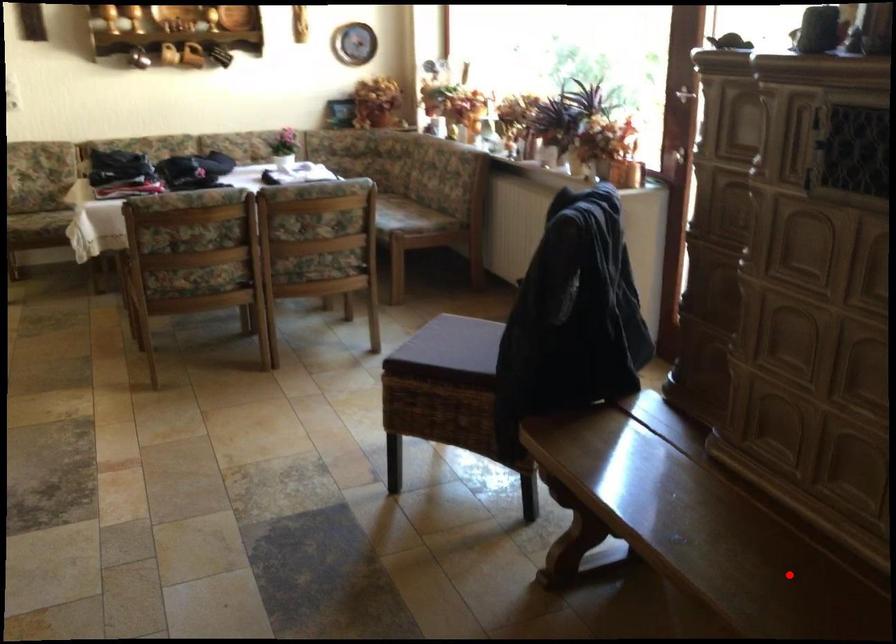
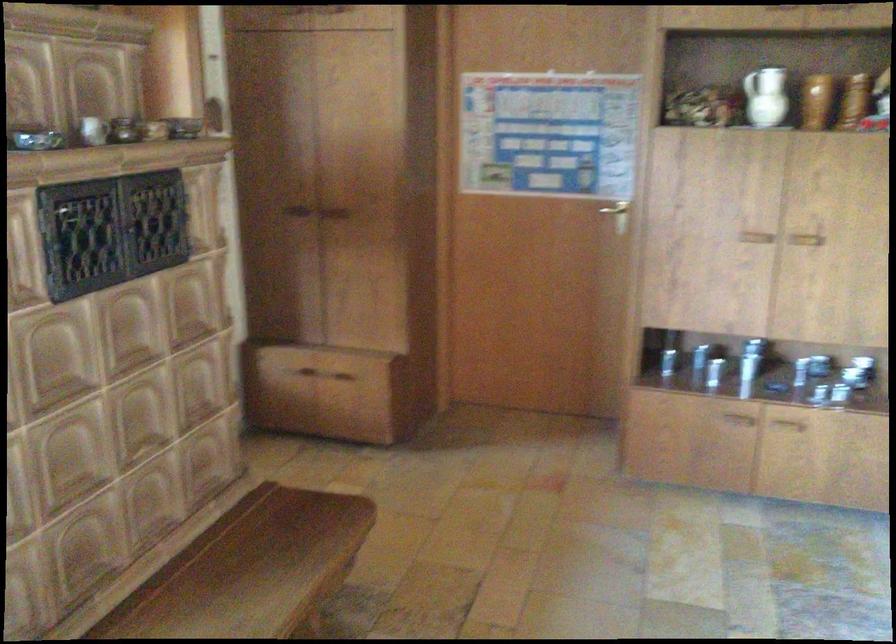
Question: I am providing you with two images of the same scene from different viewpoints. Given a red point in image1, look at the same physical point in image2. Is it:

Choices:
 (A) Closer to the viewpoint
 (B) Farther from the viewpoint

Answer: (B)